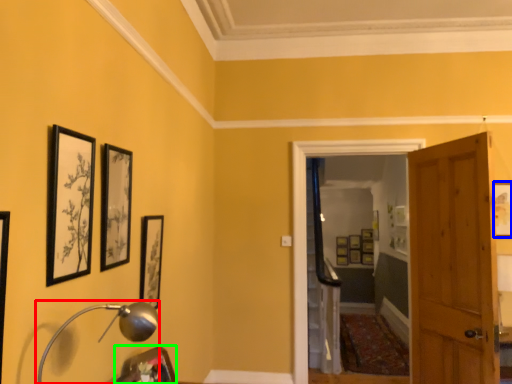
Question: Which is farther away from table lamp (highlighted by a red box)? picture frame (highlighted by a blue box) or picture frame (highlighted by a green box)?

Choices:
 (A) picture frame
 (B) picture frame

Answer: (A)